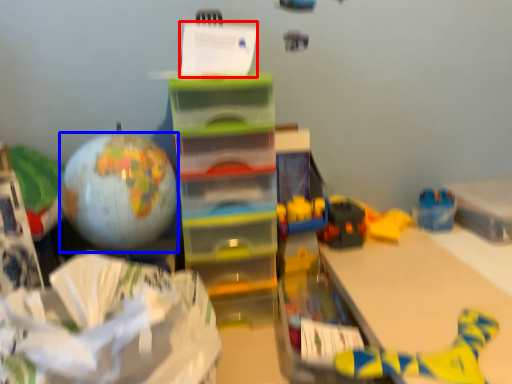
Question: Which of the following is the closest to the observer, writing (highlighted by a red box) or balloon (highlighted by a blue box)?

Choices:
 (A) writing
 (B) balloon

Answer: (B)